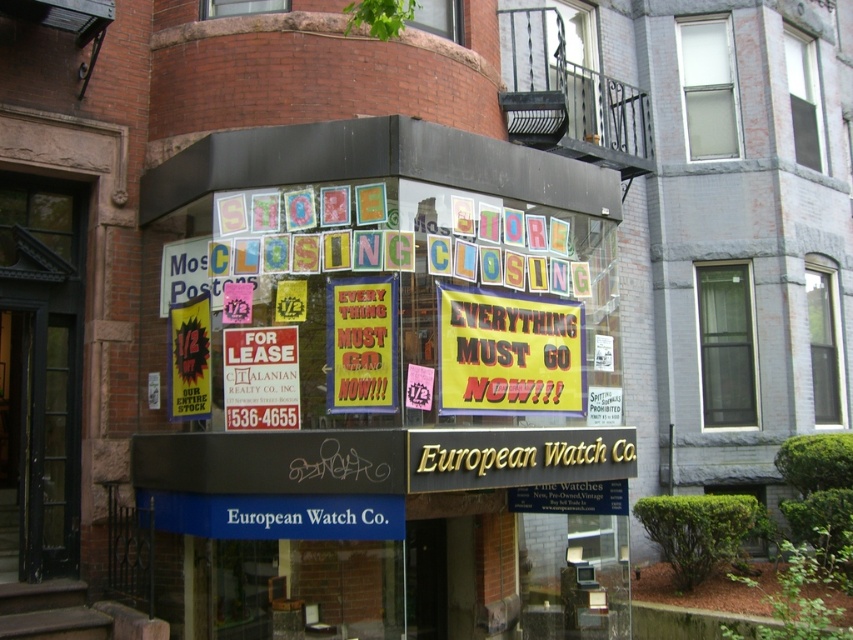
Which is above, yellow/yellowish paper sign at center or yellowmaterial/textureposter at center?

yellowmaterial/textureposter at center

Is yellow/yellowish paper sign at center to the right of yellowmaterial/textureposter at center from the viewer's perspective?

Correct, you'll find yellow/yellowish paper sign at center to the right of yellowmaterial/textureposter at center.

Which is in front, point (538, 378) or point (376, 340)?

Point (376, 340)

This screenshot has height=640, width=853. I want to click on yellow/yellowish paper sign at center, so click(508, 353).

Is yellow paper posters at center to the right of yellow/yellowish paper sign at center from the viewer's perspective?

In fact, yellow paper posters at center is to the left of yellow/yellowish paper sign at center.

Is yellow paper posters at center smaller than yellow/yellowish paper sign at center?

Indeed, yellow paper posters at center has a smaller size compared to yellow/yellowish paper sign at center.

Is point (572, 444) positioned after point (531, 307)?

No, (572, 444) is in front of (531, 307).

The width and height of the screenshot is (853, 640). Find the location of `yellow paper posters at center`. yellow paper posters at center is located at coordinates (397, 388).

Measure the distance between point (144, 272) and camera.

Point (144, 272) is 8.68 meters away from camera.

This screenshot has height=640, width=853. I want to click on yellow paper posters at center, so click(x=397, y=388).